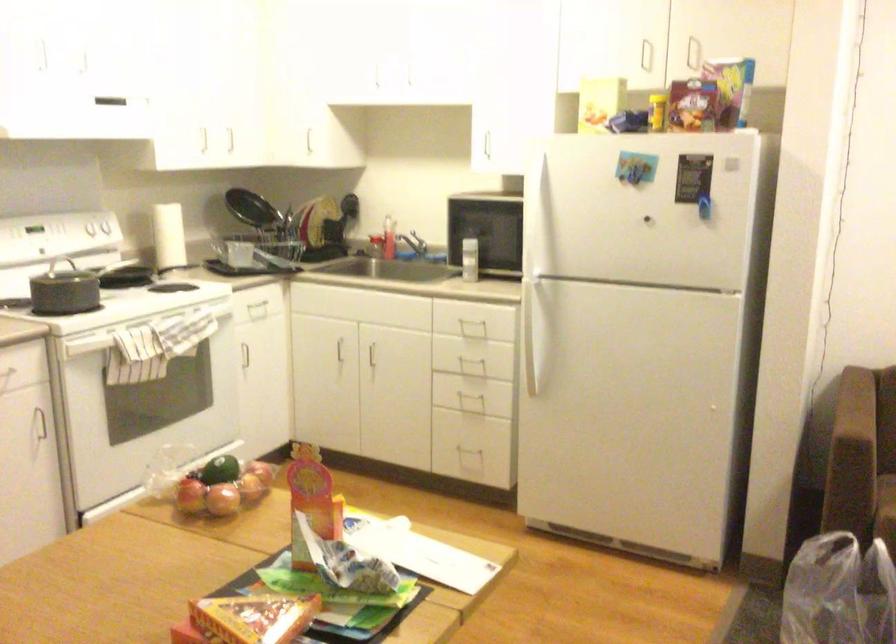
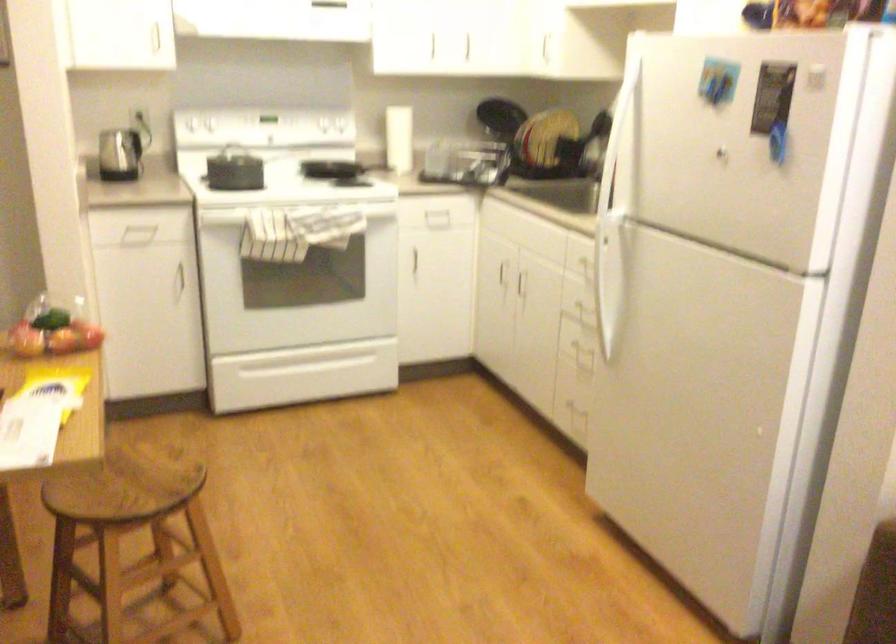
Question: I am providing you with two images of the same scene from different viewpoints. After the viewpoint changes to image2, which objects are now occluded?

Choices:
 (A) white oven door handle
 (B) black witch hat
 (C) kettle handle
 (D) white spray bottle

Answer: (D)